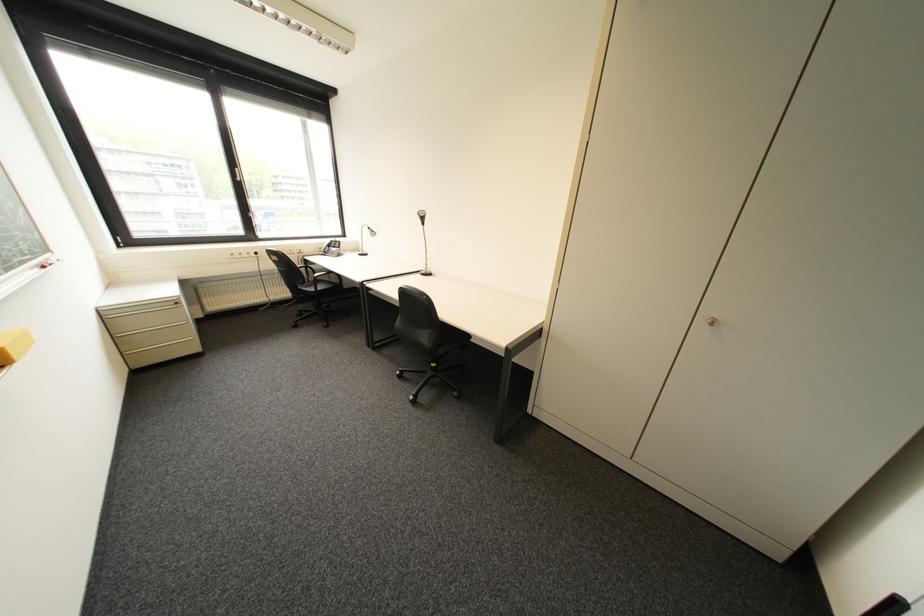
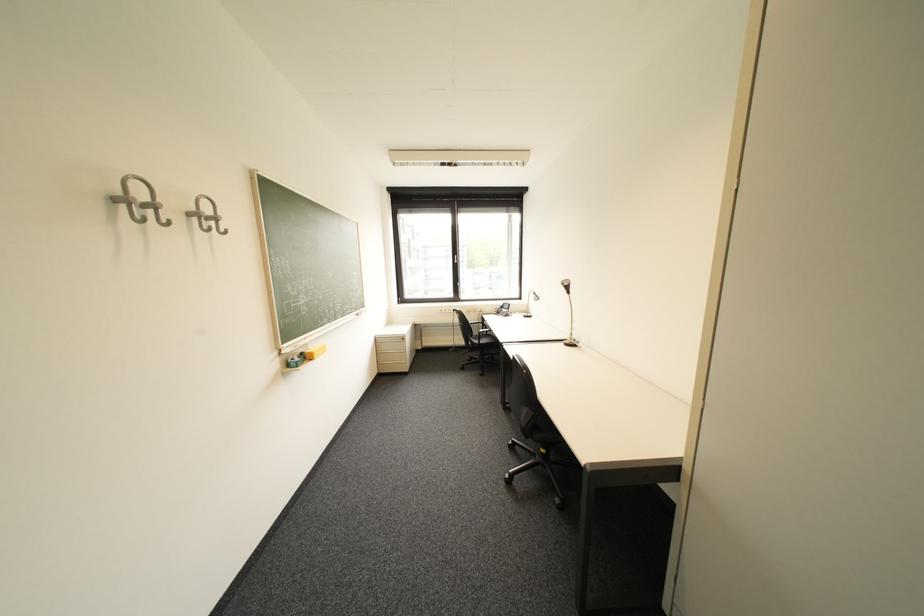
Find the pixel in the second image that matches point 350,233 in the first image.

(528, 297)